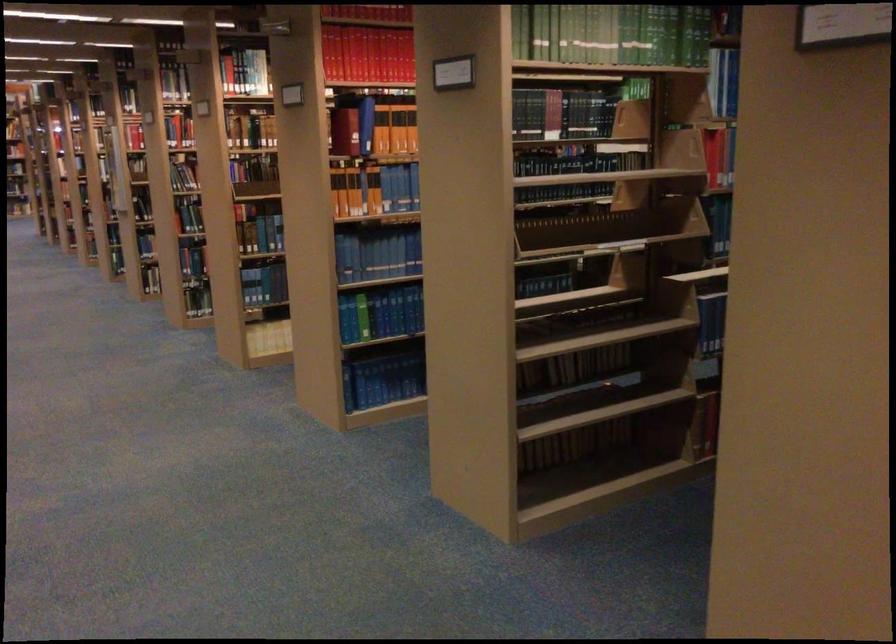
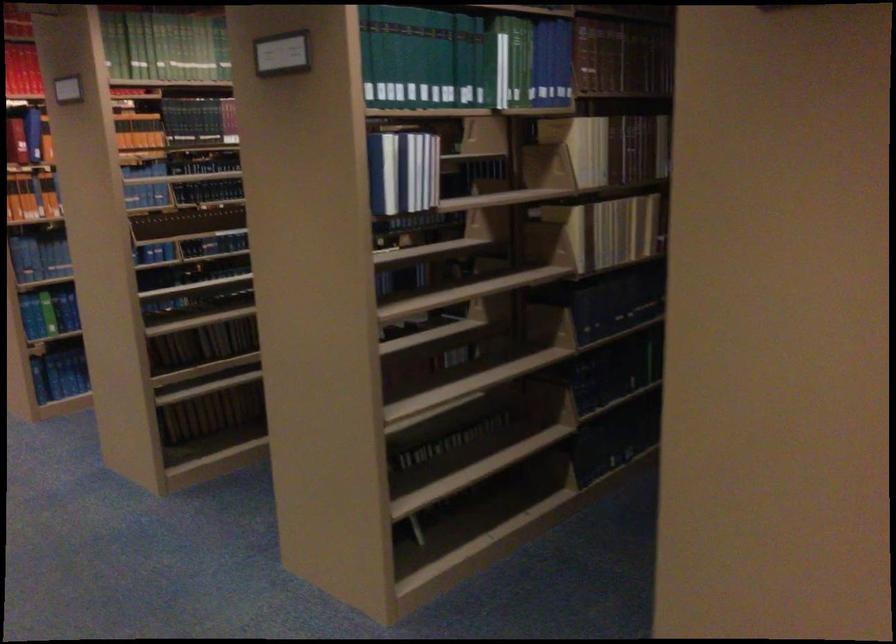
Which direction would the cameraman need to move to produce the second image?

The cameraman moved toward right, backward.